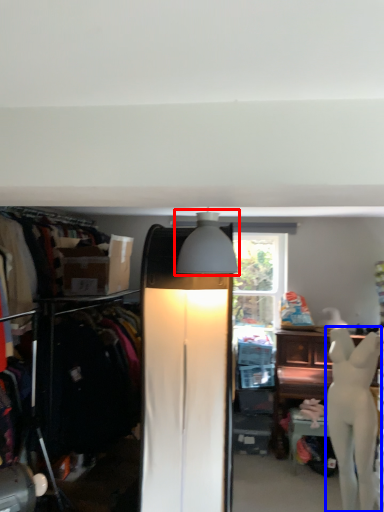
Question: Which object is closer to the camera taking this photo, lamp (highlighted by a red box) or mannequin (highlighted by a blue box)?

Choices:
 (A) lamp
 (B) mannequin

Answer: (A)